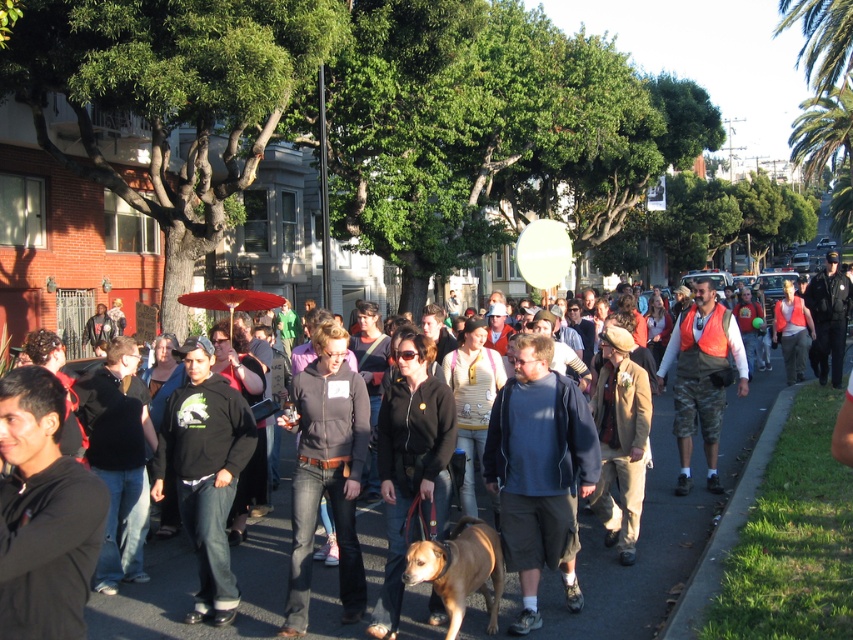
You are a photographer standing at the street level and want to take a photo of both the camouflage shorts at center and the brown furry dog at center. Which object should you focus on first to ensure both are in clear view?

You should focus on the camouflage shorts at center first since it is closer to you than the brown furry dog at center, ensuring both are in clear view.

You are a photographer standing at the edge of the street. You want to take a photo that includes both the camouflage shorts at center and the brown furry dog at center. What is the minimum distance you need to move backward to ensure both subjects are in frame?

The camouflage shorts at center is 3.93 meters from the brown furry dog at center. To include both in the frame, you need to move backward until the distance between them fits within your camera lens field of view. However, without knowing the specific focal length and sensor size of your camera, an exact distance cannot be calculated. A general rule is to position yourself at least half the distance between the two subjects, so moving back approximately 1.97 meters might help, but adjust based on your lens

You are a delivery person who needs to place a large package on the ground. You see the smooth asphalt pavement at center and the camouflage shorts at center. Which surface is more suitable for placing the package?

The smooth asphalt pavement at center is bigger than camouflage shorts at center, so the smooth asphalt pavement at center is more suitable for placing the large package.